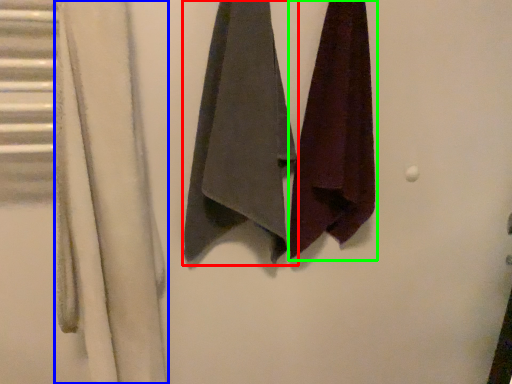
Question: Which object is positioned closest to towel (highlighted by a red box)? Select from curtain (highlighted by a blue box) and towel (highlighted by a green box).

Choices:
 (A) curtain
 (B) towel

Answer: (B)